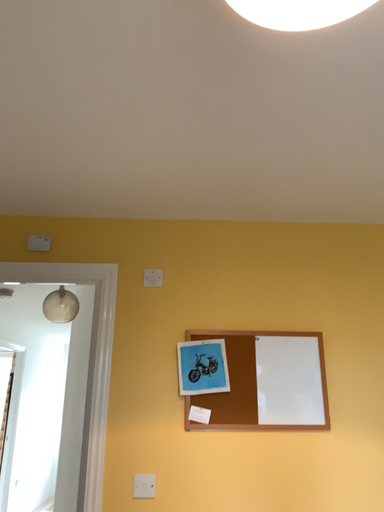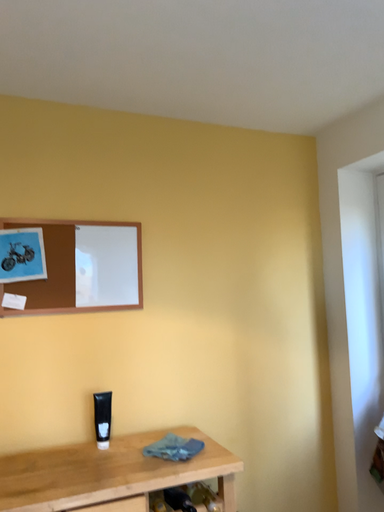
Question: Which way did the camera rotate in the video?

Choices:
 (A) rotated downward
 (B) rotated upward

Answer: (A)